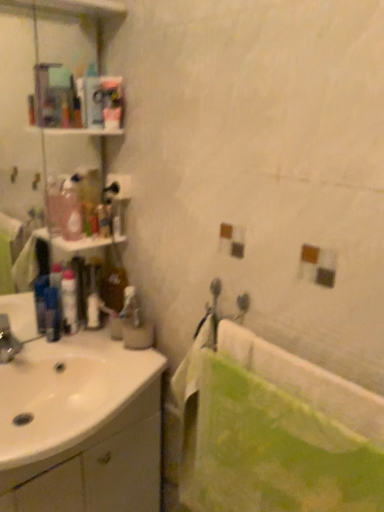
This screenshot has width=384, height=512. Identify the location of vacant area in front of blue plastic mouthwash at left. (37, 349).